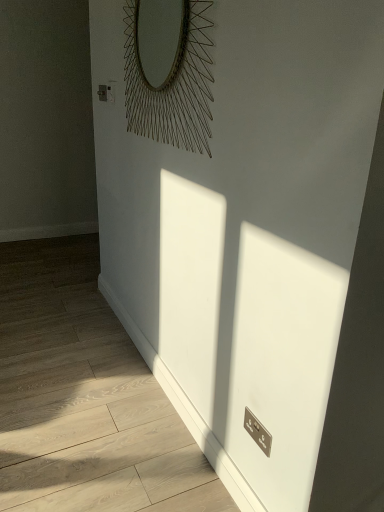
Measure the distance between point (37, 364) and camera.

The distance of point (37, 364) from camera is 2.22 meters.

What do you see at coordinates (84, 398) in the screenshot? Image resolution: width=384 pixels, height=512 pixels. I see `white glossy radiator at lower right` at bounding box center [84, 398].

Find the location of a particular element. The width and height of the screenshot is (384, 512). white glossy radiator at lower right is located at coordinates (84, 398).

What do you see at coordinates (169, 72) in the screenshot? I see `metallic wire at upper center` at bounding box center [169, 72].

Locate an element on the screen. metallic wire at upper center is located at coordinates (169, 72).

I want to click on white glossy radiator at lower right, so click(x=84, y=398).

Considering the positions of objects white glossy radiator at lower right and metallic wire at upper center in the image provided, who is more to the right, white glossy radiator at lower right or metallic wire at upper center?

metallic wire at upper center is more to the right.

Consider the image. Is white glossy radiator at lower right closer to the viewer compared to metallic wire at upper center?

That is True.

Does point (78, 473) come behind point (142, 53)?

No.

From the image's perspective, which is below, white glossy radiator at lower right or metallic wire at upper center?

white glossy radiator at lower right.

From a real-world perspective, is white glossy radiator at lower right located beneath metallic wire at upper center?

Yes, from a real-world perspective, white glossy radiator at lower right is beneath metallic wire at upper center.

In the scene shown: Is white glossy radiator at lower right wider than metallic wire at upper center?

Yes.

Which of these two, white glossy radiator at lower right or metallic wire at upper center, stands taller?

With more height is metallic wire at upper center.

Between white glossy radiator at lower right and metallic wire at upper center, which one has larger size?

Bigger between the two is white glossy radiator at lower right.

Would you say white glossy radiator at lower right is inside or outside metallic wire at upper center?

white glossy radiator at lower right is spatially situated outside metallic wire at upper center.

Is white glossy radiator at lower right directly adjacent to metallic wire at upper center?

white glossy radiator at lower right and metallic wire at upper center are clearly separated.

Is white glossy radiator at lower right aimed at metallic wire at upper center?

No, white glossy radiator at lower right is not turned towards metallic wire at upper center.

Measure the distance between white glossy radiator at lower right and metallic wire at upper center.

white glossy radiator at lower right is 1.29 meters from metallic wire at upper center.

Locate an element on the screen. Image resolution: width=384 pixels, height=512 pixels. mirror located on the right of white glossy radiator at lower right is located at coordinates (169, 72).

Does metallic wire at upper center appear on the right side of white glossy radiator at lower right?

Yes.

Relative to white glossy radiator at lower right, is metallic wire at upper center in front or behind?

In the image, metallic wire at upper center appears behind white glossy radiator at lower right.

Between point (189, 73) and point (171, 422), which one is positioned behind?

The point (171, 422) is more distant.

From the image's perspective, is metallic wire at upper center located above or below white glossy radiator at lower right?

From the image's perspective, metallic wire at upper center appears above white glossy radiator at lower right.

Consider the image. From a real-world perspective, is metallic wire at upper center physically above white glossy radiator at lower right?

Yes, from a real-world perspective, metallic wire at upper center is on top of white glossy radiator at lower right.

Looking at their sizes, would you say metallic wire at upper center is wider or thinner than white glossy radiator at lower right?

Considering their sizes, metallic wire at upper center looks slimmer than white glossy radiator at lower right.

Does metallic wire at upper center have a lesser height compared to white glossy radiator at lower right?

Incorrect, the height of metallic wire at upper center does not fall short of that of white glossy radiator at lower right.

Is metallic wire at upper center bigger than white glossy radiator at lower right?

Actually, metallic wire at upper center might be smaller than white glossy radiator at lower right.

Is metallic wire at upper center spatially inside white glossy radiator at lower right, or outside of it?

metallic wire at upper center lies outside white glossy radiator at lower right.

From the picture: Is metallic wire at upper center positioned far away from white glossy radiator at lower right?

metallic wire at upper center is far away from white glossy radiator at lower right.

Is metallic wire at upper center facing away from white glossy radiator at lower right?

metallic wire at upper center does not have its back to white glossy radiator at lower right.

How different are the orientations of metallic wire at upper center and white glossy radiator at lower right in degrees?

The angular difference between metallic wire at upper center and white glossy radiator at lower right is 89.5 degrees.

Where is `corridor to the left of metallic wire at upper center`? corridor to the left of metallic wire at upper center is located at coordinates (84, 398).

Identify the location of corridor on the left of metallic wire at upper center. (84, 398).

This screenshot has width=384, height=512. Identify the location of mirror located behind the white glossy radiator at lower right. (169, 72).